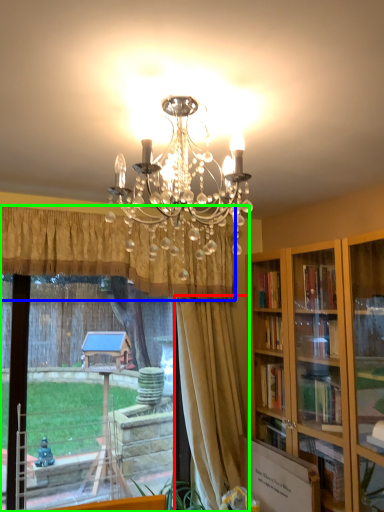
Question: Considering the real-world distances, which object is farthest from curtain (highlighted by a red box)? curtain (highlighted by a blue box) or window (highlighted by a green box)?

Choices:
 (A) curtain
 (B) window

Answer: (A)